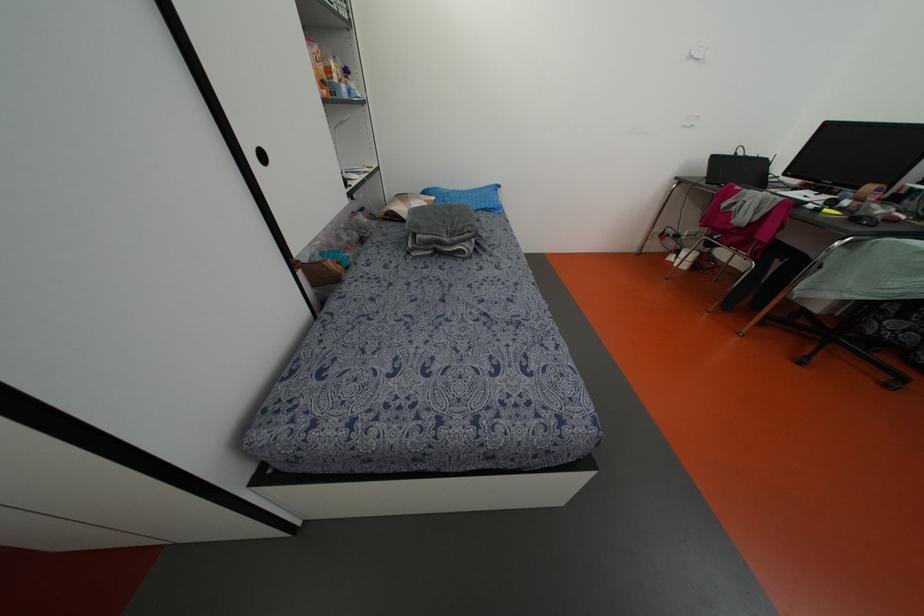
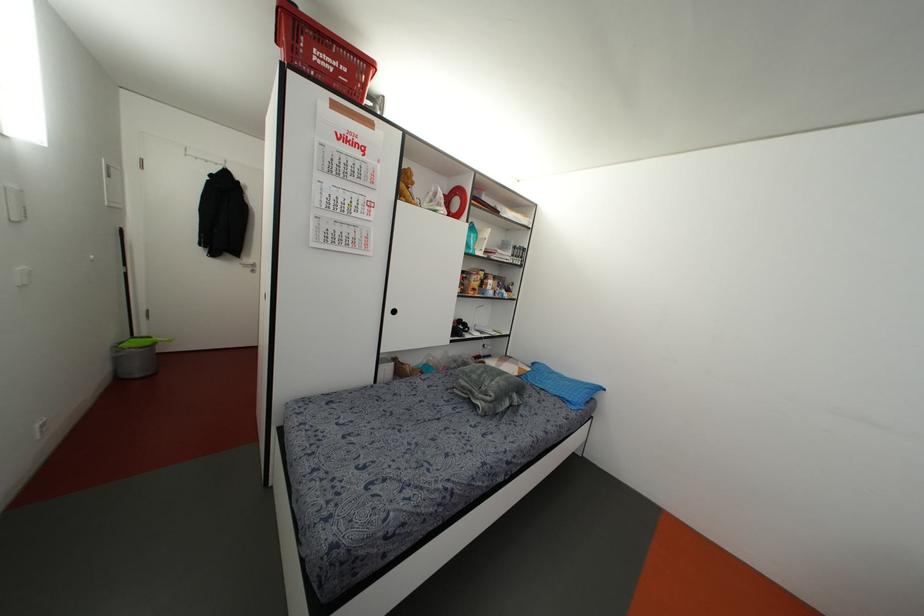
Where in the second image is the point corresponding to (492,206) from the first image?

(569, 399)